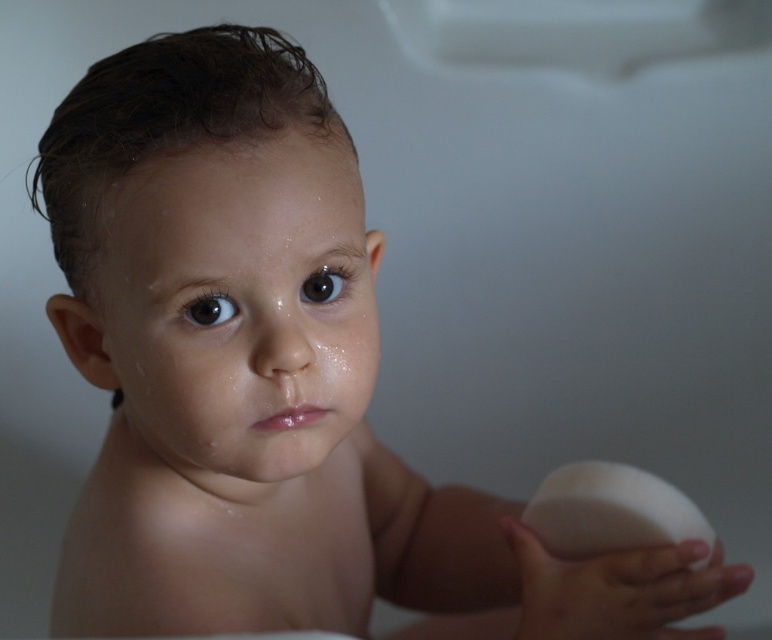
Question: Which point is closer to the camera?

Choices:
 (A) white matte ball at lower right
 (B) white matte soap at lower right

Answer: (A)

Question: Can you confirm if white matte ball at lower right is positioned above white matte soap at lower right?

Choices:
 (A) no
 (B) yes

Answer: (A)

Question: Does white matte ball at lower right have a larger size compared to white matte soap at lower right?

Choices:
 (A) no
 (B) yes

Answer: (A)

Question: Among these points, which one is nearest to the camera?

Choices:
 (A) (615, 589)
 (B) (574, 547)

Answer: (A)

Question: Is white matte ball at lower right positioned in front of white matte soap at lower right?

Choices:
 (A) yes
 (B) no

Answer: (A)